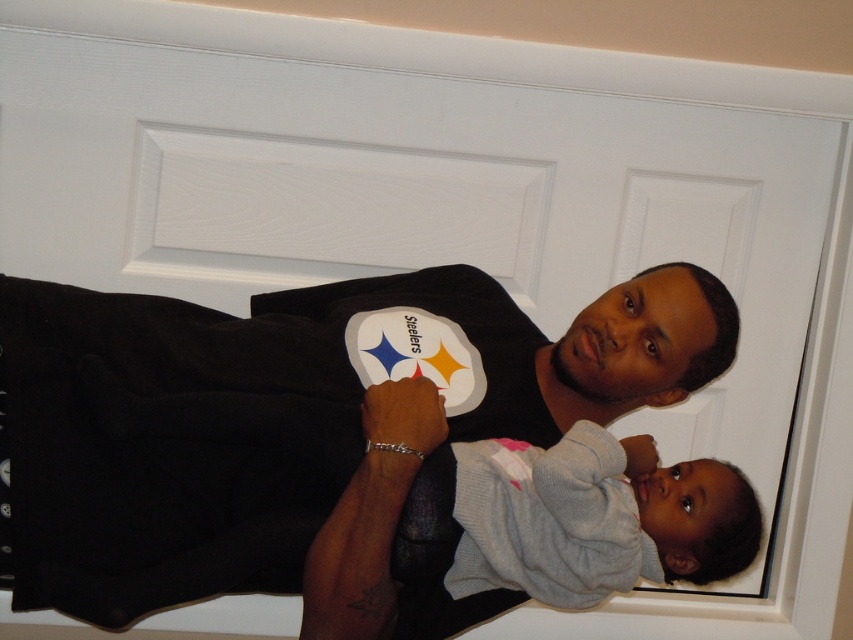
Question: Does black cotton shirt at center lie in front of gray sweater at center?

Choices:
 (A) no
 (B) yes

Answer: (B)

Question: Is black cotton shirt at center smaller than gray sweater at center?

Choices:
 (A) no
 (B) yes

Answer: (A)

Question: Does black cotton shirt at center appear over gray sweater at center?

Choices:
 (A) no
 (B) yes

Answer: (B)

Question: Which of the following is the closest to the observer?

Choices:
 (A) gray sweater at center
 (B) black cotton shirt at center

Answer: (B)